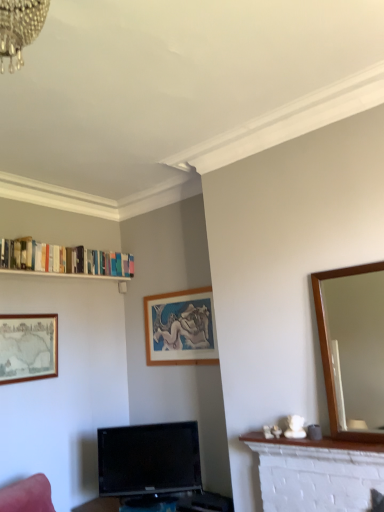
Locate an element on the screen. The height and width of the screenshot is (512, 384). free spot above white glossy bookshelf at upper left (from a real-world perspective) is located at coordinates (81, 271).